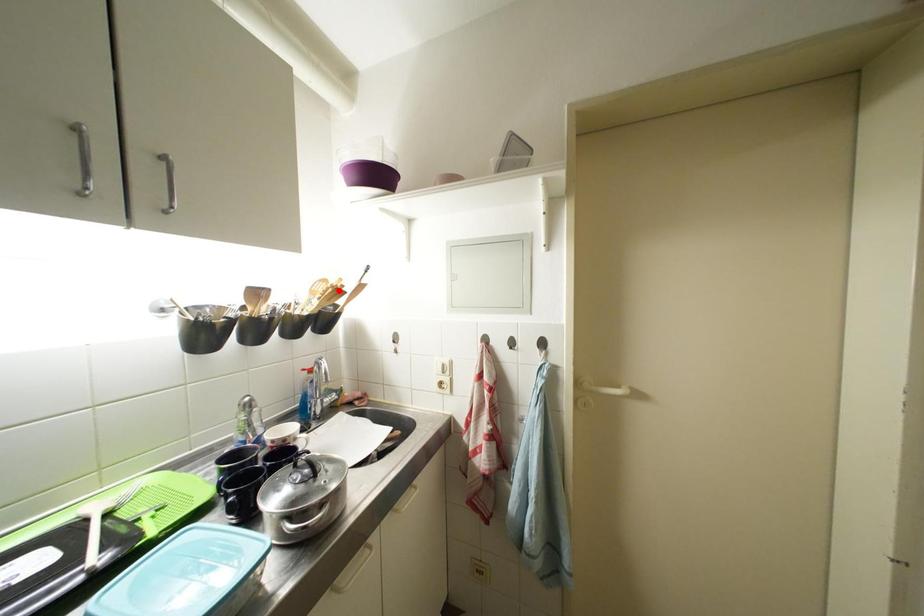
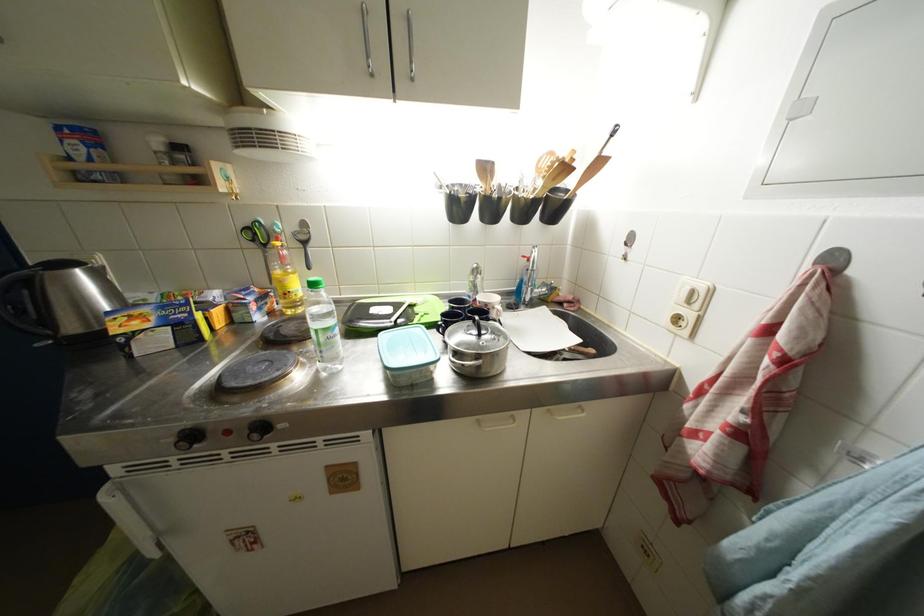
Find the pixel in the second image that matches the highlighted location in the first image.

(565, 164)